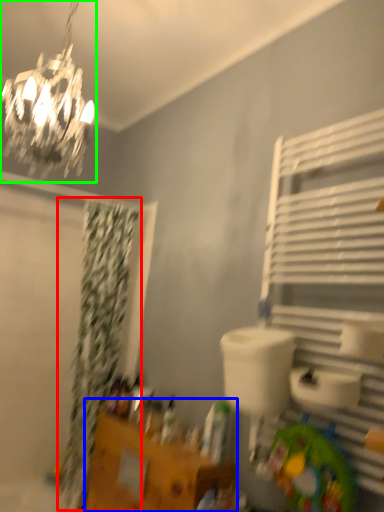
Question: Which is farther away from shower curtain (highlighted by a red box)? vanity (highlighted by a blue box) or lamp (highlighted by a green box)?

Choices:
 (A) vanity
 (B) lamp

Answer: (B)